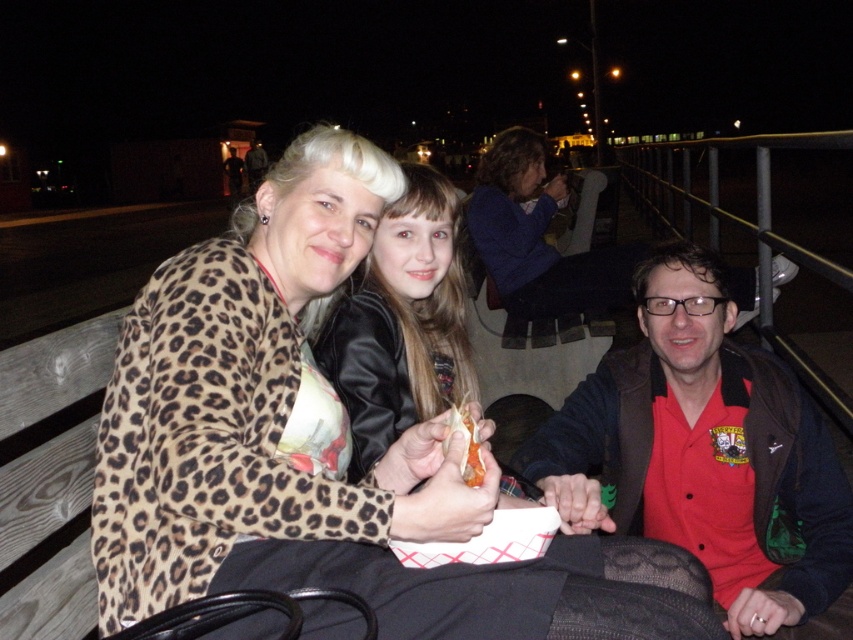
You are a photographer trying to capture a group photo of the leopard print jacket at left and the leather jacket at center. Since you want to ensure both subjects are in focus, you need to know their heights. Which of the two jackets is taller?

The leopard print jacket at left is much taller than the leather jacket at center, so the photographer should adjust the camera angle to account for the height difference to ensure both are in focus.

You are standing in front of the bench and want to hand a gift to the person in the red cotton shirt at right without disturbing the person in the leather jacket at center. Which direction should you approach from?

The red cotton shirt at right is to the right of the leather jacket at center, so you should approach from the right side of the leather jacket at center to reach the red cotton shirt at right without disturbing the middle person.

You are a photographer setting up a tripod to take a group photo of the three people on the wooden bench. The red cotton shirt at right and the leather jacket at center are in your frame. Based on their sizes, which clothing item should you focus on first to ensure proper framing?

The red cotton shirt at right is larger in size than the leather jacket at center, so you should focus on the red cotton shirt at right first to ensure proper framing since it occupies more space in the frame.